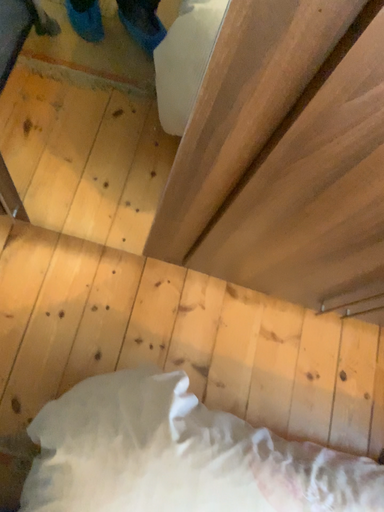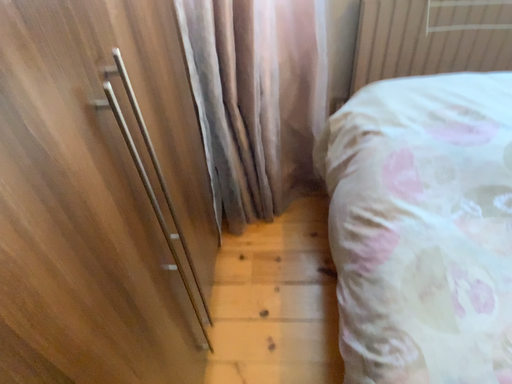
Question: How did the camera likely rotate when shooting the video?

Choices:
 (A) rotated downward
 (B) rotated upward

Answer: (B)